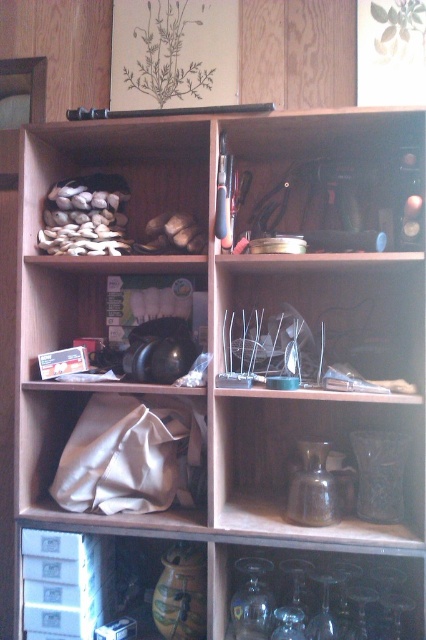
You are organizing a display and need to place the matte glass vase at center and the white fabric at lower left. Given their sizes, which object should be placed first to ensure stability?

The matte glass vase at center is larger than the white fabric at lower left, so it should be placed first to ensure stability by using its larger base as a foundation.

What is located at the point with coordinates [115,451]?

The point at coordinates [115,451] marks the location of white fabric at lower left.

You are standing in front of the shelving unit and want to reach both the point at (250, 496) and the point at (192, 435). Which point will you need to stretch your arm less to reach?

Point (250, 496) is closer to you than point (192, 435), so you will need to stretch your arm less to reach point (250, 496).